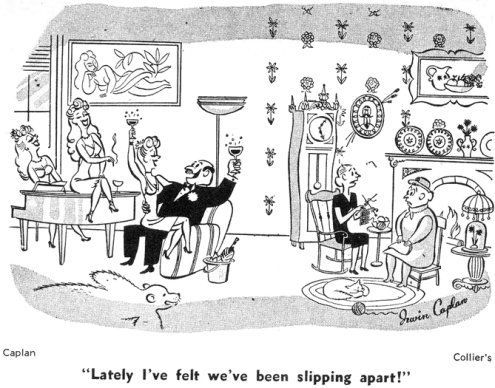
Where is `rocking chair`? rocking chair is located at coordinates (326, 238).